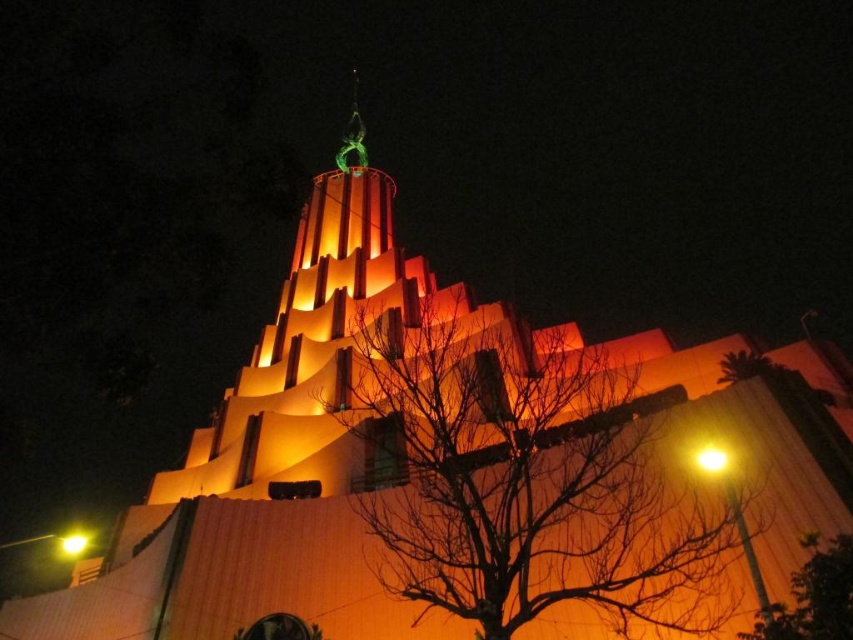
Does green leafy tree at lower right appear under yellow/golden glass streetlight at lower left?

Incorrect, green leafy tree at lower right is not positioned below yellow/golden glass streetlight at lower left.

From the picture: Does green leafy tree at lower right lie behind yellow/golden glass streetlight at lower left?

No, it is in front of yellow/golden glass streetlight at lower left.

Who is more distant from viewer, (828, 627) or (80, 545)?

The point (80, 545) is more distant.

Where is `green leafy tree at lower right`? green leafy tree at lower right is located at coordinates (813, 596).

Can you confirm if bare branches at center is smaller than green metallic statue at upper center?

Yes.

Which is in front, point (374, 442) or point (354, 150)?

Point (374, 442)

In order to click on bare branches at center in this screenshot , I will do `click(527, 484)`.

Which is below, bare branches at center or yellow matte light at upper right?

yellow matte light at upper right is lower down.

Which is more to the left, bare branches at center or yellow matte light at upper right?

bare branches at center is more to the left.

What do you see at coordinates (527, 484) in the screenshot?
I see `bare branches at center` at bounding box center [527, 484].

This screenshot has height=640, width=853. In order to click on bare branches at center in this screenshot , I will do `click(527, 484)`.